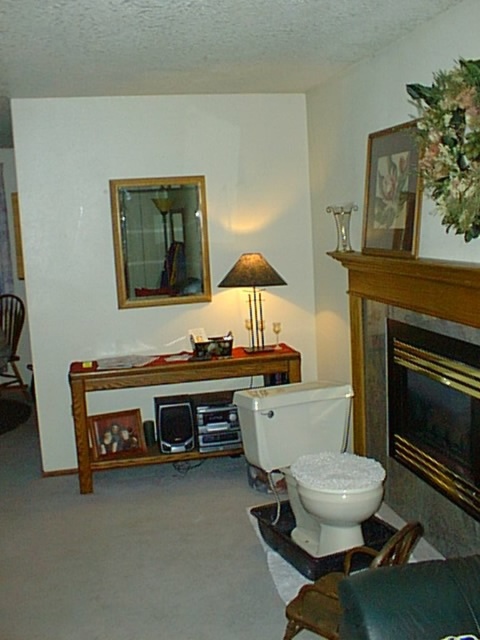
You are standing in the living room and want to take a photo of both the point at coordinates (408, 237) and the point at coordinates (19, 268). Which point will appear larger in the photo?

Point at coordinates (408, 237) will appear larger in the photo because it is closer to the camera than the point at coordinates (19, 268).

You are standing at point (15, 218) and want to walk to point (288, 477). Is the path directly in front of you or behind you?

The path to point (288, 477) is directly in front of you because point (288, 477) is in front of point (15, 218).